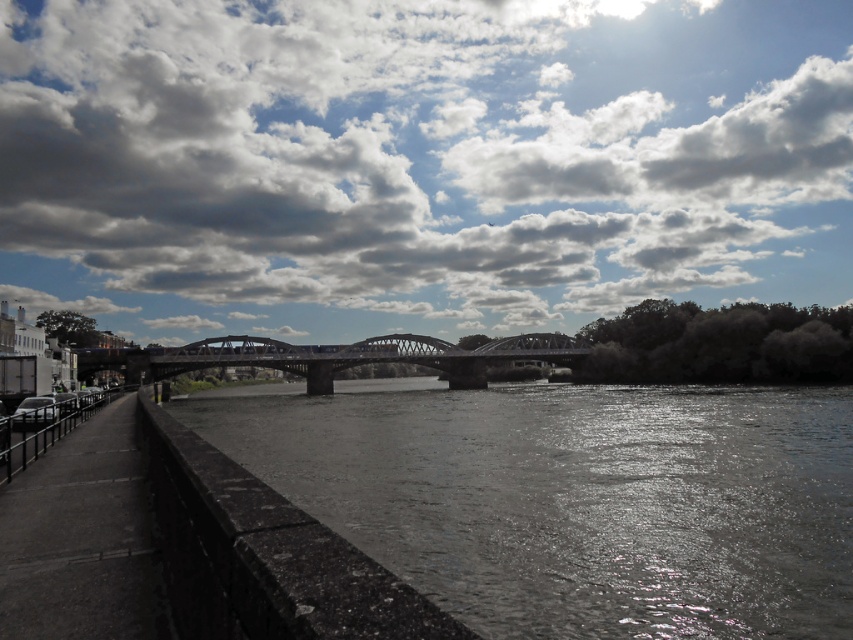
You are standing on the riverside walkway and notice the cloudy sky at upper center and the metallic bridge at center. Which object is located to the right of the other?

The cloudy sky at upper center is positioned on the right side of the metallic bridge at center.

You are standing at the point marked by the coordinates point (x=573, y=499) in the riverside scene. What is the immediate surface you are standing on?

The immediate surface you are standing on is the dark gray concrete river at center, as the coordinates point (x=573, y=499) corresponds to this location.